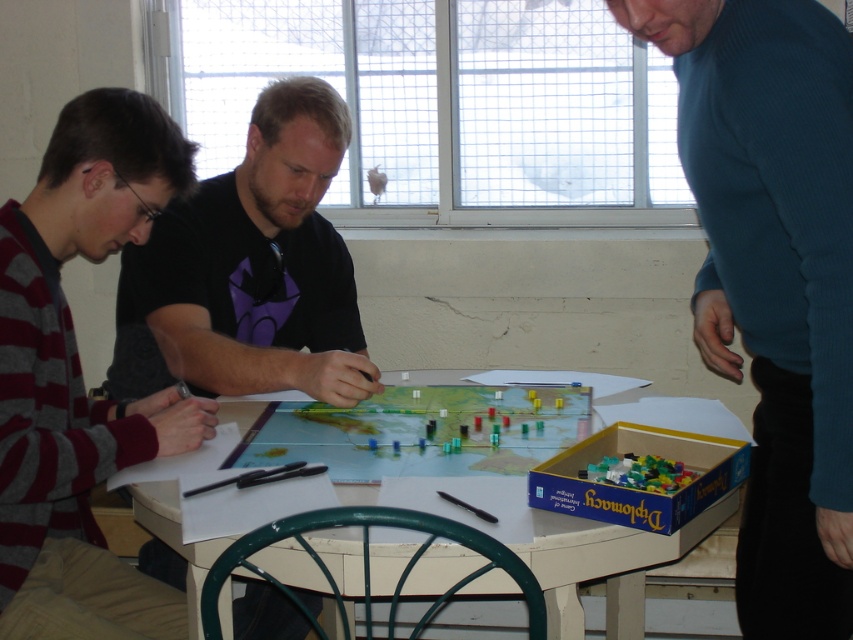
Can you confirm if white glossy table at center is shorter than translucent plastic lego pieces at lower right?

No.

Is white glossy table at center bigger than translucent plastic lego pieces at lower right?

Indeed, white glossy table at center has a larger size compared to translucent plastic lego pieces at lower right.

Image resolution: width=853 pixels, height=640 pixels. What do you see at coordinates (587, 540) in the screenshot?
I see `white glossy table at center` at bounding box center [587, 540].

Find the location of a particular element. The width and height of the screenshot is (853, 640). white glossy table at center is located at coordinates (587, 540).

Does point (810, 508) come in front of point (374, 467)?

Yes, point (810, 508) is closer to viewer.

In the scene shown: Who is more distant from viewer, (844, 474) or (422, 468)?

Point (422, 468)

Is point (730, 49) positioned behind point (334, 458)?

No, it is not.

Locate an element on the screen. This screenshot has height=640, width=853. dark blue sweater at right is located at coordinates (775, 278).

Does wooden map at center have a smaller size compared to translucent plastic lego pieces at lower right?

Incorrect, wooden map at center is not smaller in size than translucent plastic lego pieces at lower right.

Find the location of a particular element. The image size is (853, 640). wooden map at center is located at coordinates (421, 432).

Is point (403, 449) more distant than point (671, 480)?

That is True.

You are a GUI agent. You are given a task and a screenshot of the screen. Output one action in this format:
    pyautogui.click(x=<x>, y=<y>)
    Task: Click on the wooden map at center
    This screenshot has width=853, height=640.
    Given the screenshot: What is the action you would take?
    pyautogui.click(x=421, y=432)